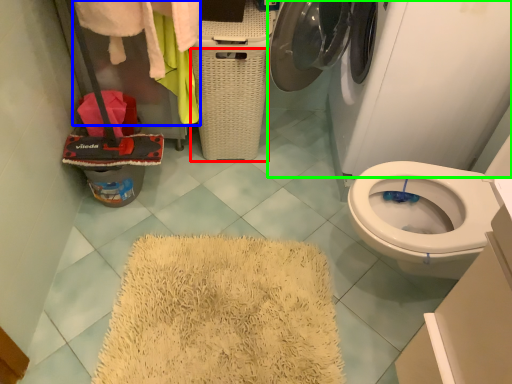
Question: Considering the real-world distances, which object is closest to basket (highlighted by a red box)? clothing (highlighted by a blue box) or washing machine (highlighted by a green box).

Choices:
 (A) clothing
 (B) washing machine

Answer: (A)